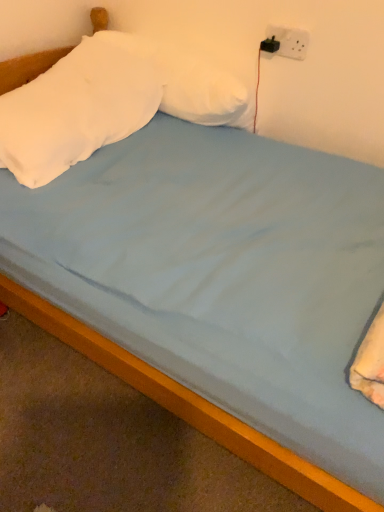
Question: Could you tell me if wooden bed frame at lower center is turned towards white soft pillow at upper left, which is the 2th pillow from right to left?

Choices:
 (A) yes
 (B) no

Answer: (B)

Question: From a real-world perspective, is wooden bed frame at lower center positioned under white soft pillow at upper left, the 1th pillow when ordered from left to right, based on gravity?

Choices:
 (A) yes
 (B) no

Answer: (A)

Question: Can you confirm if wooden bed frame at lower center is positioned to the left of white soft pillow at upper left, the 1th pillow when ordered from left to right?

Choices:
 (A) no
 (B) yes

Answer: (A)

Question: Is wooden bed frame at lower center with white soft pillow at upper left, which is the 2th pillow from right to left?

Choices:
 (A) no
 (B) yes

Answer: (A)

Question: Considering the relative positions of wooden bed frame at lower center and white soft pillow at upper left, which is the 2th pillow from right to left, in the image provided, is wooden bed frame at lower center to the right of white soft pillow at upper left, which is the 2th pillow from right to left, from the viewer's perspective?

Choices:
 (A) no
 (B) yes

Answer: (B)

Question: Would you say wooden bed frame at lower center is outside white soft pillow at upper left, the 1th pillow when ordered from left to right?

Choices:
 (A) yes
 (B) no

Answer: (A)

Question: From the image's perspective, does wooden bed frame at lower center appear lower than white soft pillow at upper center, acting as the 1th pillow starting from the right?

Choices:
 (A) yes
 (B) no

Answer: (A)

Question: Is wooden bed frame at lower center far away from white soft pillow at upper center, acting as the 1th pillow starting from the right?

Choices:
 (A) no
 (B) yes

Answer: (A)

Question: Is white soft pillow at upper center, the 2th pillow positioned from the left, at the back of wooden bed frame at lower center?

Choices:
 (A) no
 (B) yes

Answer: (A)

Question: Considering the relative sizes of wooden bed frame at lower center and white soft pillow at upper center, acting as the 1th pillow starting from the right, in the image provided, is wooden bed frame at lower center taller than white soft pillow at upper center, acting as the 1th pillow starting from the right,?

Choices:
 (A) yes
 (B) no

Answer: (B)

Question: Is wooden bed frame at lower center shorter than white soft pillow at upper center, the 2th pillow positioned from the left?

Choices:
 (A) yes
 (B) no

Answer: (A)

Question: Does wooden bed frame at lower center have a lesser width compared to white soft pillow at upper center, acting as the 1th pillow starting from the right?

Choices:
 (A) no
 (B) yes

Answer: (A)

Question: Is white soft pillow at upper left, which is the 2th pillow from right to left, facing towards white plastic socket at upper right?

Choices:
 (A) yes
 (B) no

Answer: (B)